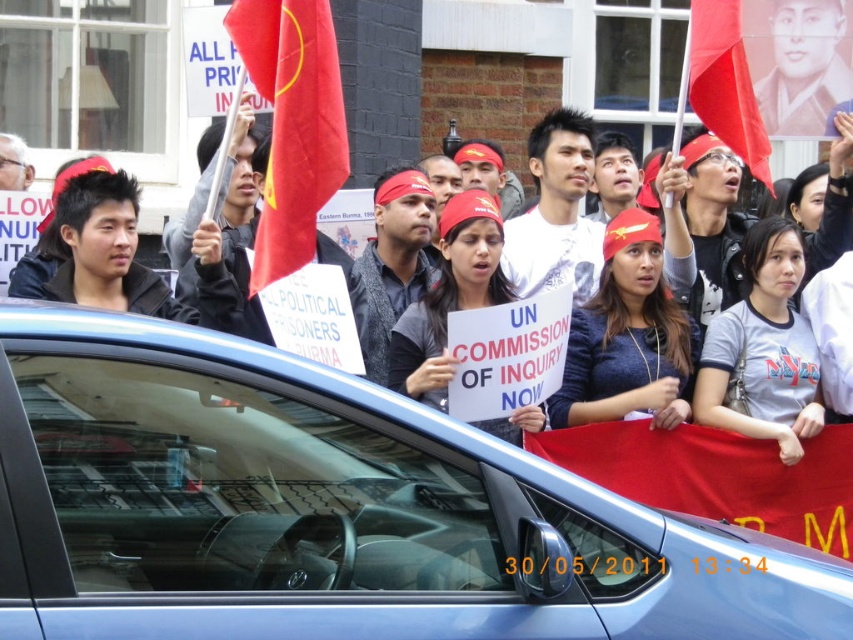
Question: Is matte red headband at center below matte red flag at upper right?

Choices:
 (A) yes
 (B) no

Answer: (A)

Question: Can you confirm if blue metallic car at center is bigger than matte red bandana at center?

Choices:
 (A) no
 (B) yes

Answer: (A)

Question: Estimate the real-world distances between objects in this image. Which object is farther from the matte red headband at center?

Choices:
 (A) red fabric flag at center
 (B) blue metallic car at center

Answer: (B)

Question: Based on their relative distances, which object is farther from the red fabric flag at center?

Choices:
 (A) matte red bandana at center
 (B) matte red flag at upper right

Answer: (B)

Question: Which point appears closest to the camera in this image?

Choices:
 (A) (735, 65)
 (B) (701, 376)

Answer: (A)

Question: Is gray cotton t-shirt at center wider than matte gray shirt at center?

Choices:
 (A) yes
 (B) no

Answer: (A)